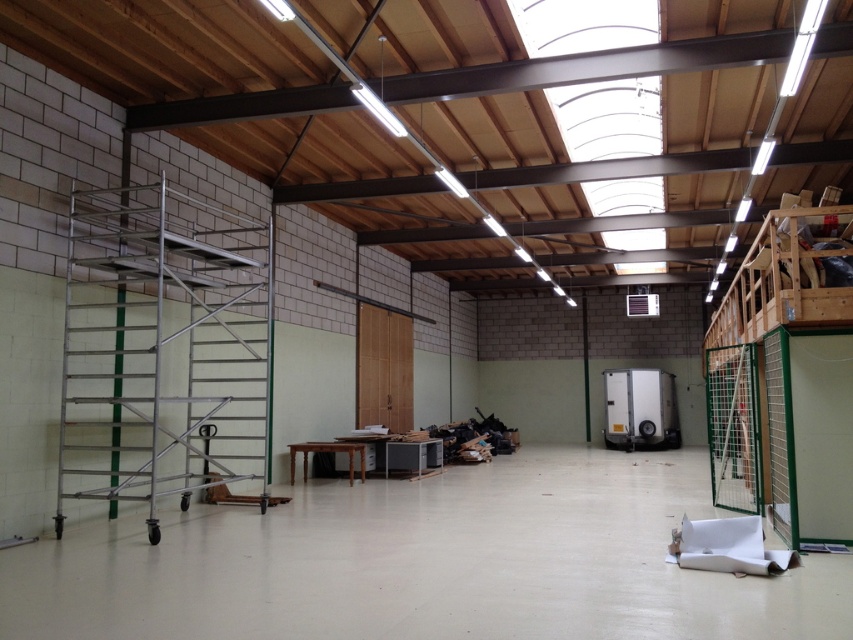
Question: Observing the image, what is the correct spatial positioning of white glossy refrigerator at center in reference to metallic gray printer at center?

Choices:
 (A) below
 (B) above

Answer: (B)

Question: Which point is farther to the camera?

Choices:
 (A) white glossy refrigerator at center
 (B) metallic gray printer at center
 (C) silver metallic scaffolding at left

Answer: (A)

Question: Does silver metallic scaffolding at left appear under metallic gray printer at center?

Choices:
 (A) yes
 (B) no

Answer: (B)

Question: Which of the following is the closest to the observer?

Choices:
 (A) white glossy refrigerator at center
 (B) silver metallic scaffolding at left

Answer: (B)

Question: Is white glossy refrigerator at center above metallic gray printer at center?

Choices:
 (A) no
 (B) yes

Answer: (B)

Question: Which object is the farthest from the metallic gray printer at center?

Choices:
 (A) white glossy refrigerator at center
 (B) silver metallic scaffolding at left

Answer: (A)